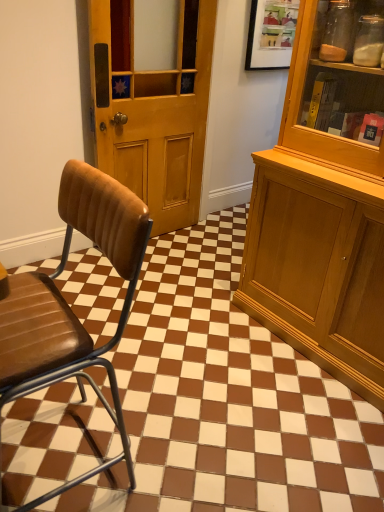
This screenshot has width=384, height=512. Describe the element at coordinates (321, 228) in the screenshot. I see `light brown wood cabinet at right` at that location.

The height and width of the screenshot is (512, 384). Find the location of `light brown wood cabinet at right`. light brown wood cabinet at right is located at coordinates (321, 228).

The width and height of the screenshot is (384, 512). Identify the location of light brown wood cabinet at right. (321, 228).